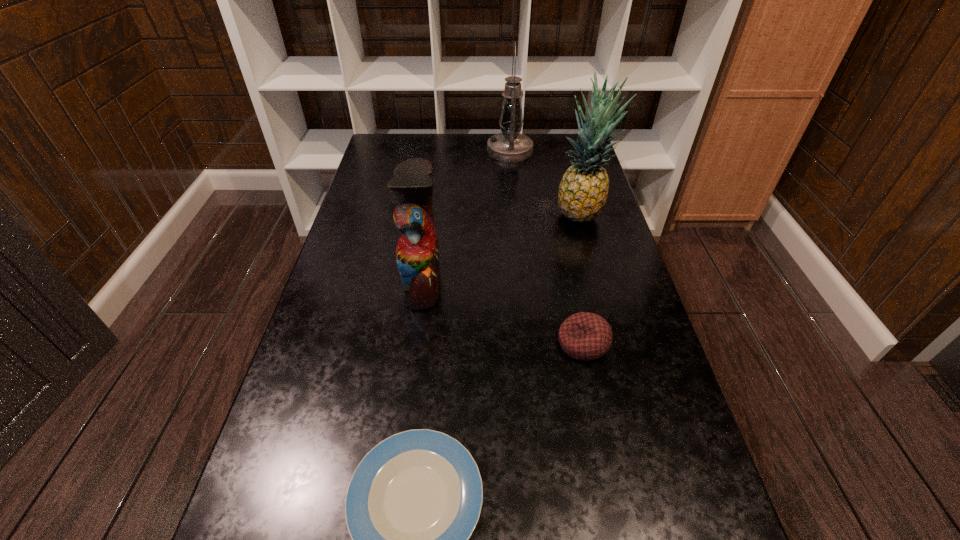
The image size is (960, 540). Identify the location of object positioned at the far edge. (509, 146).

Image resolution: width=960 pixels, height=540 pixels. I want to click on pineapple present at the right edge, so click(x=583, y=190).

Identify the location of beanbag situated at the right edge. The width and height of the screenshot is (960, 540). [585, 336].

This screenshot has height=540, width=960. In the image, there is a desktop. What are the coordinates of `vacant space at the far edge` in the screenshot? It's located at (479, 143).

Image resolution: width=960 pixels, height=540 pixels. I want to click on vacant point at the left edge, so click(368, 234).

At what (x,y) coordinates should I click in order to perform the action: click on free region at the right edge. Please return your answer as a coordinate pair (x, y). This screenshot has height=540, width=960. Looking at the image, I should click on (657, 436).

The image size is (960, 540). In the image, there is a desktop. Find the location of `vacant space at the far left corner`. vacant space at the far left corner is located at coordinates (397, 150).

Image resolution: width=960 pixels, height=540 pixels. Identify the location of free space between the farthest object and the beanbag. (546, 247).

The image size is (960, 540). Identify the location of free spot between the fourth farthest object and the oil lamp. (546, 247).

The image size is (960, 540). Identify the location of empty location between the second farthest object and the oil lamp. (544, 182).